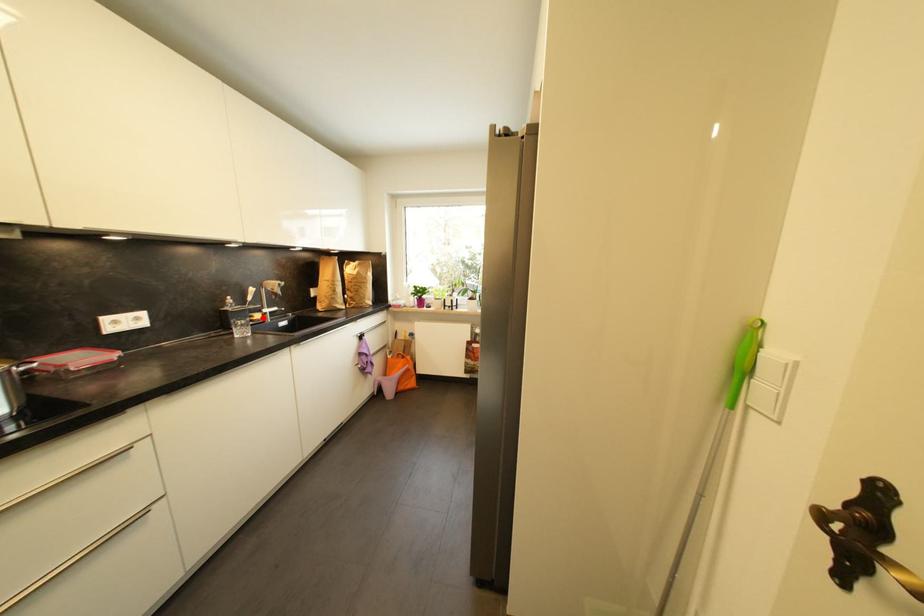
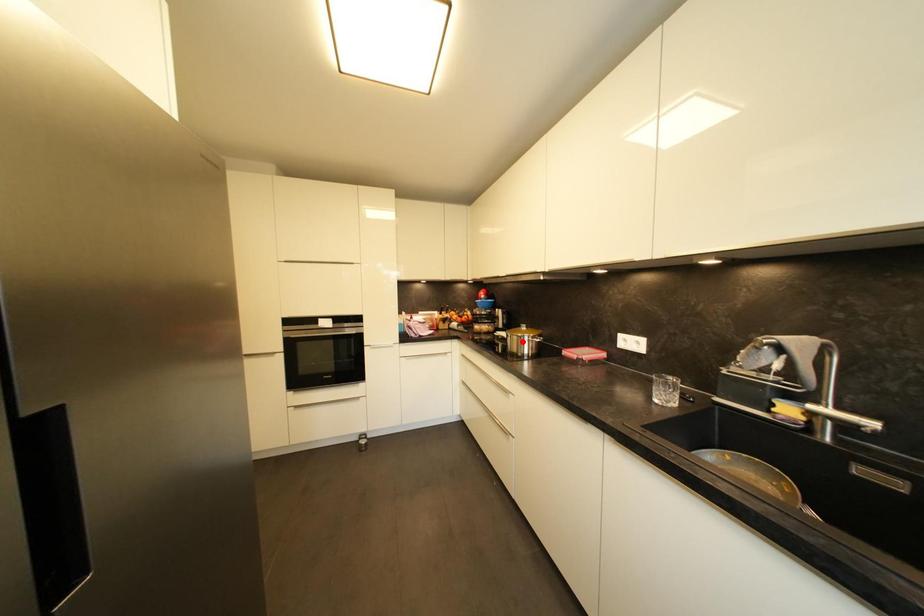
I am providing you with two images of the same scene from different viewpoints. A red point is marked on the first image and another point is marked on the second image. Is the marked point in image1 the same physical position as the marked point in image2?

No